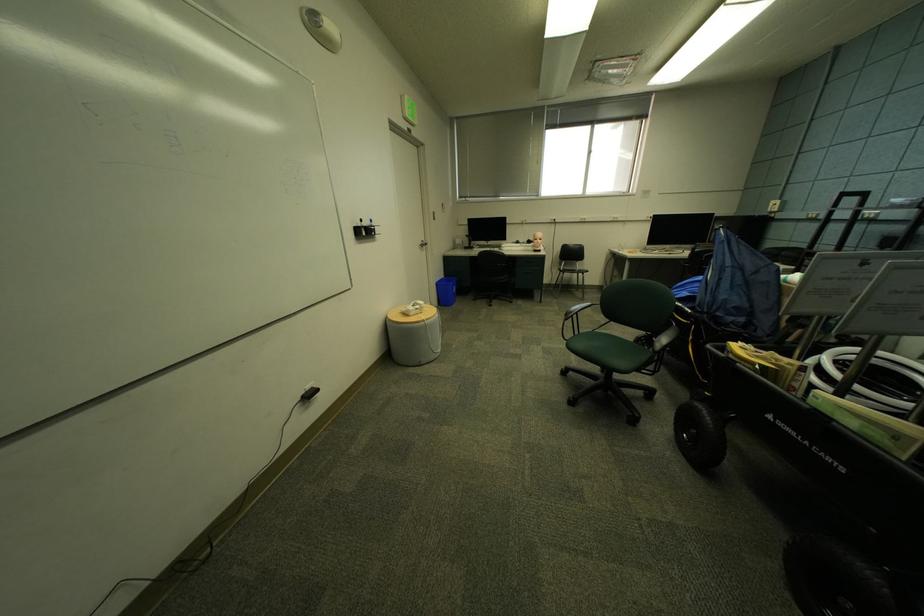
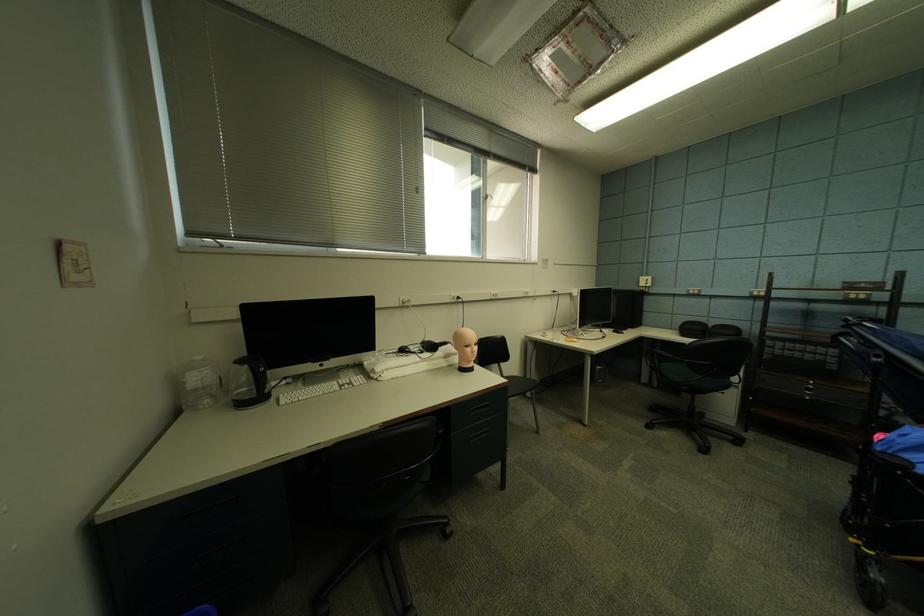
Where in the second image is the point corresponding to (658,220) from the first image?

(561, 294)